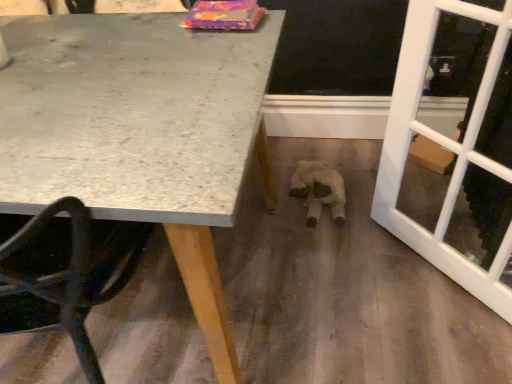
Locate an element on the screen. Image resolution: width=512 pixels, height=384 pixels. vacant space to the left of white glass screen door at right is located at coordinates pyautogui.click(x=354, y=273).